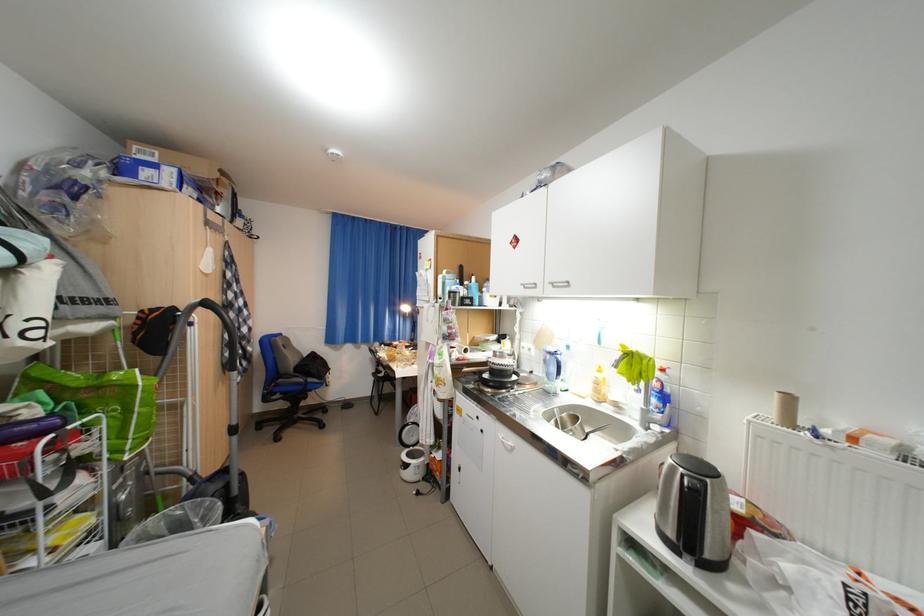
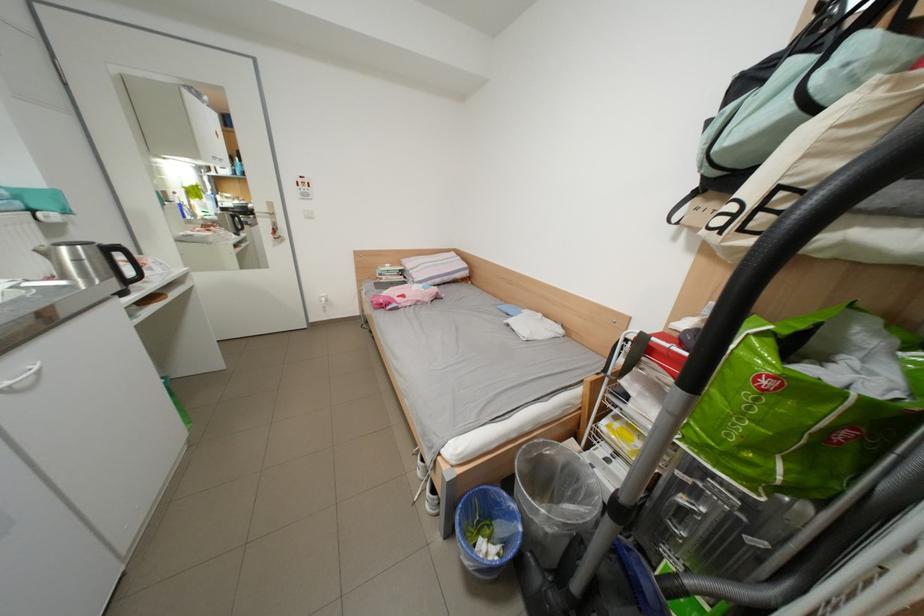
In the second image, find the point that corresponds to point (79, 334) in the first image.

(856, 245)